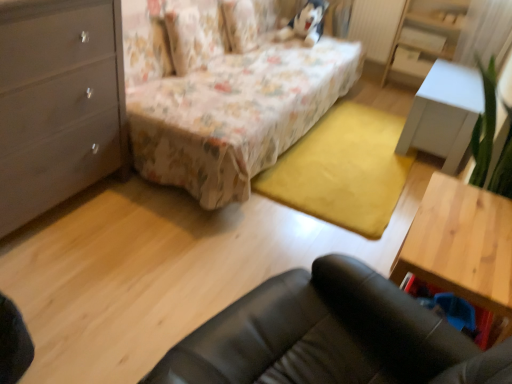
Find the location of a particular element. blank space above wooden table at lower right, the second table viewed from the top (from a real-world perspective) is located at coordinates (469, 225).